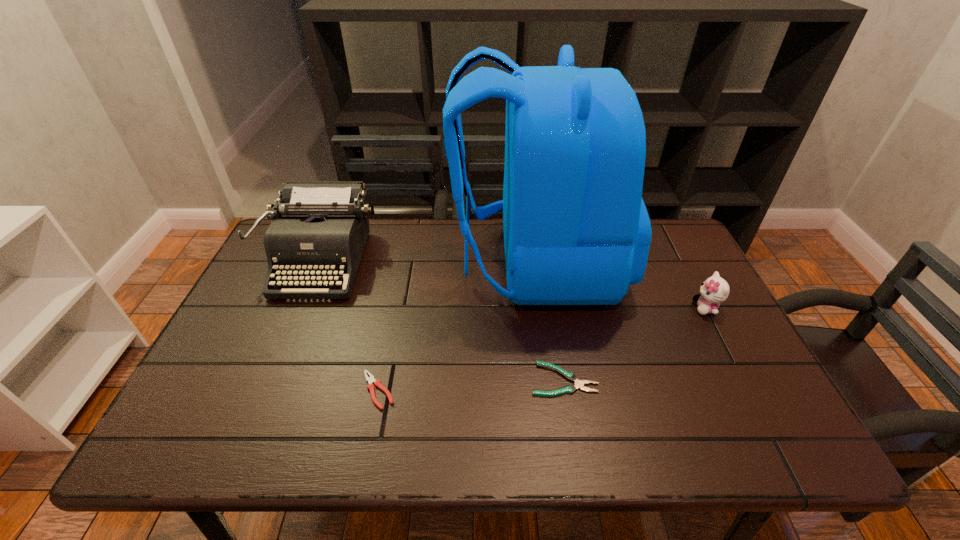
You are a GUI agent. You are given a task and a screenshot of the screen. Output one action in this format:
    pyautogui.click(x=<x>, y=<y>)
    Task: Click on the tallest object
    The height and width of the screenshot is (540, 960).
    Given the screenshot: What is the action you would take?
    pyautogui.click(x=576, y=230)

You are a GUI agent. You are given a task and a screenshot of the screen. Output one action in this format:
    pyautogui.click(x=<x>, y=<y>)
    Task: Click on the typewriter
    The width and height of the screenshot is (960, 540).
    Given the screenshot: What is the action you would take?
    pyautogui.click(x=319, y=229)

The height and width of the screenshot is (540, 960). In order to click on the leftmost object in this screenshot , I will do `click(319, 229)`.

Where is `the third shortest object`? The width and height of the screenshot is (960, 540). the third shortest object is located at coordinates (714, 290).

This screenshot has height=540, width=960. Find the location of `kitten`. kitten is located at coordinates click(714, 290).

Locate an element on the screen. The width and height of the screenshot is (960, 540). the left pliers is located at coordinates 370,380.

Identify the location of the right pliers. (579, 384).

Image resolution: width=960 pixels, height=540 pixels. In order to click on vacant space located 0.110m on the back of the backpack in this screenshot , I will do `click(417, 262)`.

Where is `blank area located 0.180m on the back of the backpack`? blank area located 0.180m on the back of the backpack is located at coordinates (394, 262).

Find the location of `vacant space located on the back of the backpack`. vacant space located on the back of the backpack is located at coordinates (396, 262).